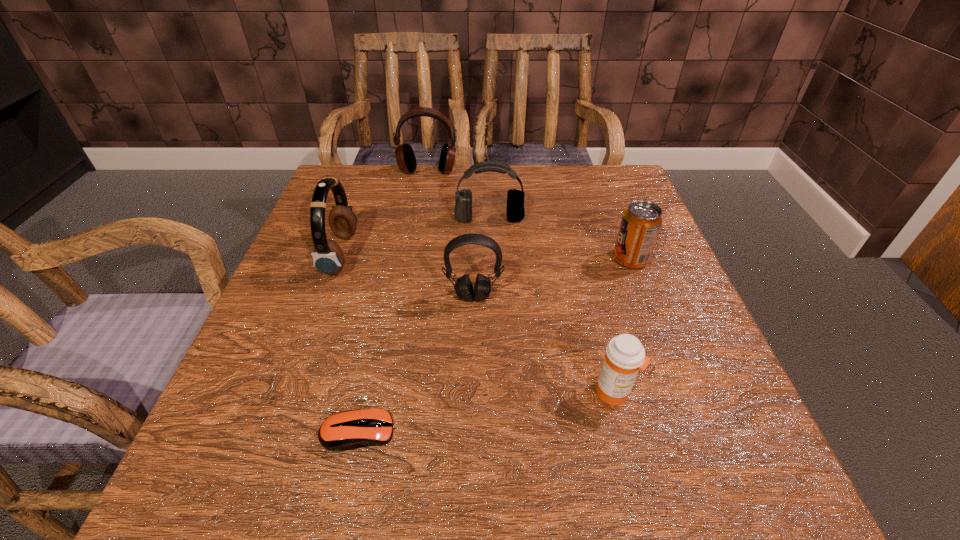
The image size is (960, 540). I want to click on vacant area that lies between the farthest headset and the computer mouse, so click(x=393, y=302).

Identify which object is the second nearest to the third nearest headset. Please provide its 2D coordinates. Your answer should be formatted as a tuple, i.e. [(x, y)], where the tuple contains the x and y coordinates of a point satisfying the conditions above.

[(641, 222)]

In order to click on object that is the third closest to the third nearest object in this screenshot , I will do `click(625, 355)`.

Locate which headset is the second closest to the leftmost headset. Please provide its 2D coordinates. Your answer should be formatted as a tuple, i.e. [(x, y)], where the tuple contains the x and y coordinates of a point satisfying the conditions above.

[(515, 211)]

Choose which headset is the third nearest neighbor to the nearest headset. Please provide its 2D coordinates. Your answer should be formatted as a tuple, i.e. [(x, y)], where the tuple contains the x and y coordinates of a point satisfying the conditions above.

[(405, 157)]

Locate an element on the screen. The image size is (960, 540). free space in the image that satisfies the following two spatial constraints: 1. on the ear pads of the farthest object; 2. on the right side of the sixth farthest object is located at coordinates (391, 392).

Image resolution: width=960 pixels, height=540 pixels. I want to click on free space that satisfies the following two spatial constraints: 1. on the headband of the third nearest headset; 2. on the right side of the rightmost object, so click(491, 259).

This screenshot has width=960, height=540. Identify the location of vacant point that satisfies the following two spatial constraints: 1. on the ear cup of the rightmost object; 2. on the right side of the leftmost headset. (339, 259).

Identify the location of vacant area in the image that satisfies the following two spatial constraints: 1. on the ear pads of the farthest headset; 2. on the right side of the soda can. The image size is (960, 540). (413, 259).

This screenshot has height=540, width=960. What are the coordinates of `free space that satisfies the following two spatial constraints: 1. on the headband of the second farthest object; 2. on the ear cup of the leftmost object` in the screenshot? It's located at (491, 254).